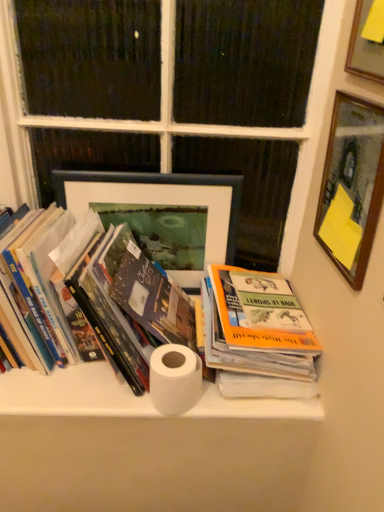
Where is `free space to the left of white matte toilet paper at center`? This screenshot has height=512, width=384. free space to the left of white matte toilet paper at center is located at coordinates (100, 392).